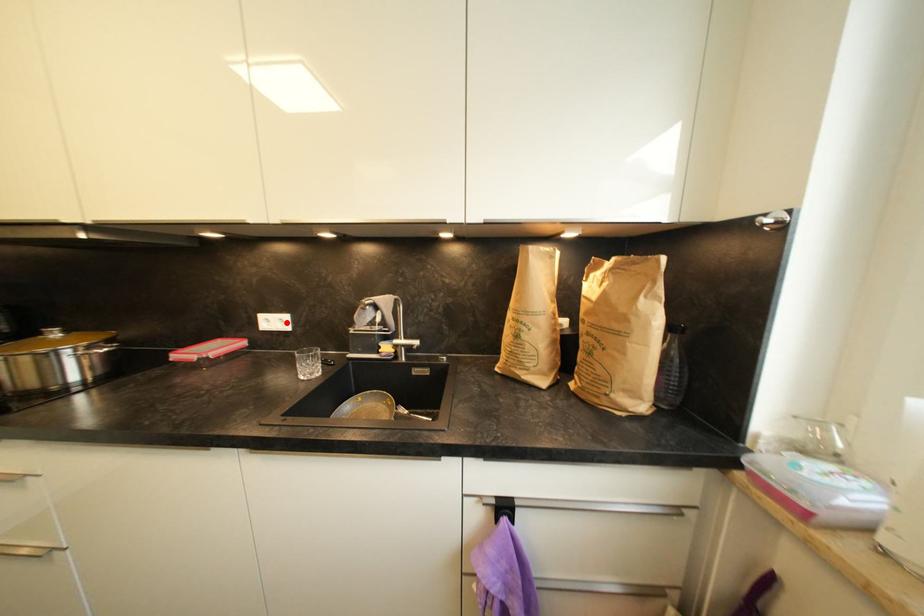
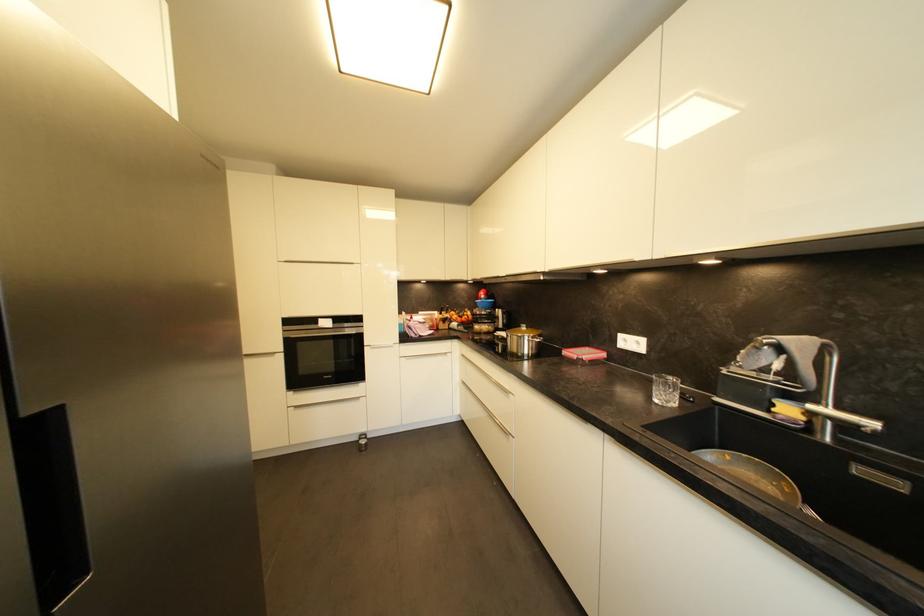
In the second image, find the point that corresponds to the highlighted location in the first image.

(642, 345)